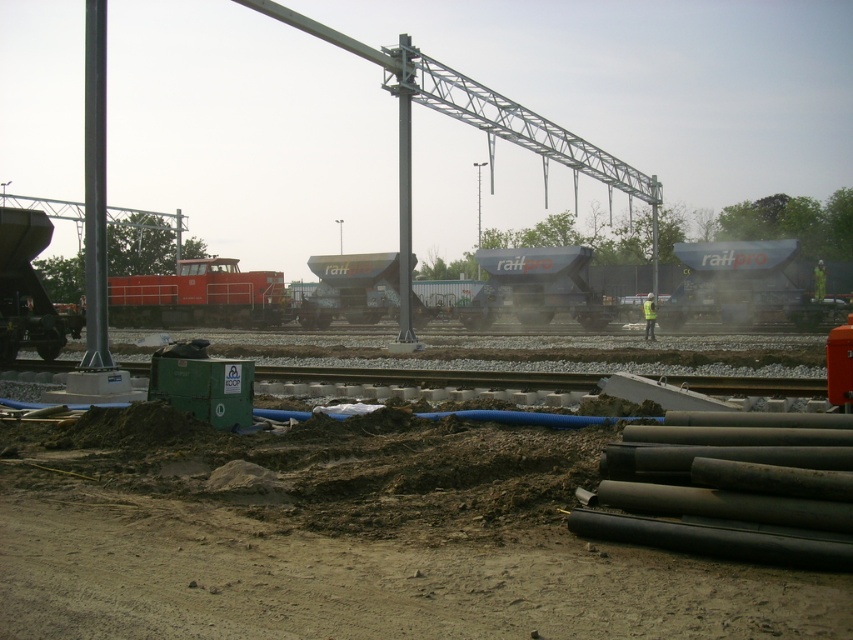
Is brown soil at lower left positioned before metallic gray pole at center?

Yes.

The width and height of the screenshot is (853, 640). What do you see at coordinates (349, 538) in the screenshot?
I see `brown soil at lower left` at bounding box center [349, 538].

Identify the location of brown soil at lower left. (349, 538).

Between brown soil at lower left and smooth metallic pole at left, which one is positioned higher?

smooth metallic pole at left is higher up.

Identify the location of brown soil at lower left. (349, 538).

Is smooth metallic pole at left bigger than yellow reflective vest at center?

Yes, smooth metallic pole at left is bigger than yellow reflective vest at center.

Can you confirm if smooth metallic pole at left is wider than yellow reflective vest at center?

Indeed, smooth metallic pole at left has a greater width compared to yellow reflective vest at center.

At what (x,y) coordinates should I click in order to perform the action: click on smooth metallic pole at left. Please return your answer as a coordinate pair (x, y). Image resolution: width=853 pixels, height=640 pixels. Looking at the image, I should click on (96, 189).